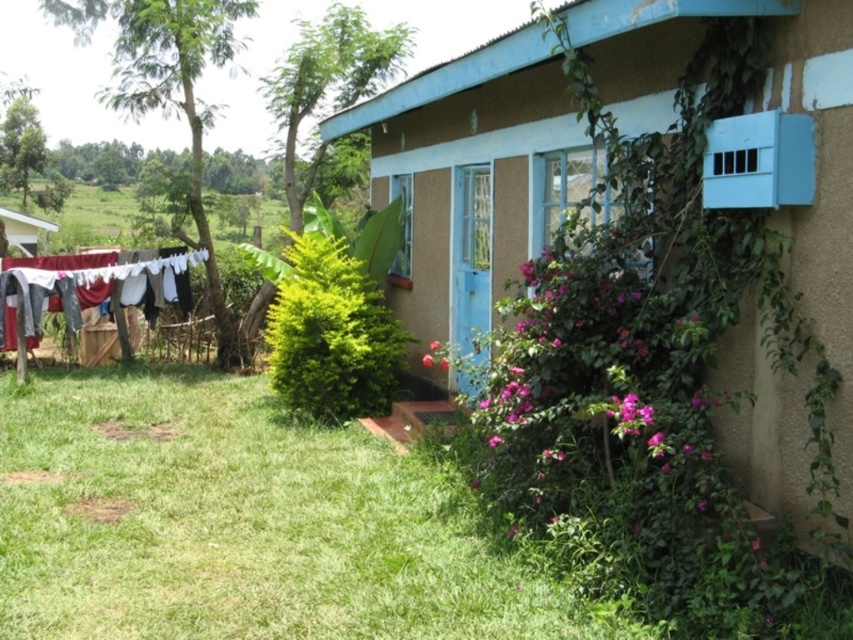
You are standing in front of the house and want to pick up something from the green grass at lower left and the white fabric at left. Which one is easier to reach without moving your feet?

The green grass at lower left is closer to the viewer than the white fabric at left, so it is easier to reach without moving your feet.

You are standing in front of the matte brown house at center and want to take a photo. If your camera requires a minimum distance of 4 meters to focus properly, will you be able to take a clear photo?

The matte brown house at center and camera are 4.06 meters apart. Since the required minimum distance is 4 meters, you are just within the range, so yes, you can take a clear photo.

You are standing at the center of the image. Which direction should you move to reach the green grass at lower left?

The green grass at lower left is located at point (238, 524), so you should move towards the lower left direction to reach it.